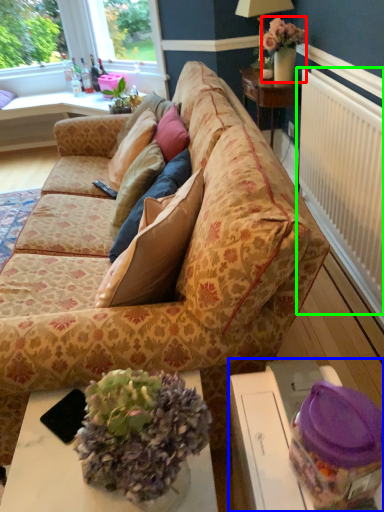
Question: Considering the real-world distances, which object is closest to houseplant (highlighted by a red box)? table (highlighted by a blue box) or radiator (highlighted by a green box).

Choices:
 (A) table
 (B) radiator

Answer: (B)